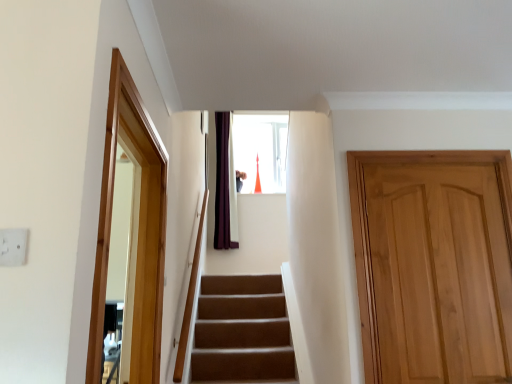
Question: Is wooden frame at left positioned with its back to light brown wood door at right?

Choices:
 (A) no
 (B) yes

Answer: (A)

Question: Does wooden frame at left contain light brown wood door at right?

Choices:
 (A) yes
 (B) no

Answer: (B)

Question: From a real-world perspective, is wooden frame at left located beneath light brown wood door at right?

Choices:
 (A) no
 (B) yes

Answer: (A)

Question: Does wooden frame at left have a smaller size compared to light brown wood door at right?

Choices:
 (A) no
 (B) yes

Answer: (A)

Question: Does wooden frame at left have a larger size compared to light brown wood door at right?

Choices:
 (A) no
 (B) yes

Answer: (B)

Question: Is wooden frame at left oriented towards light brown wood door at right?

Choices:
 (A) no
 (B) yes

Answer: (B)

Question: Does light brown wood door at right lie in front of wooden frame at left?

Choices:
 (A) no
 (B) yes

Answer: (A)

Question: Is light brown wood door at right far from wooden frame at left?

Choices:
 (A) yes
 (B) no

Answer: (A)

Question: From a real-world perspective, is light brown wood door at right positioned over wooden frame at left based on gravity?

Choices:
 (A) no
 (B) yes

Answer: (A)

Question: Does light brown wood door at right appear on the left side of wooden frame at left?

Choices:
 (A) no
 (B) yes

Answer: (A)

Question: Can you confirm if light brown wood door at right is positioned to the right of wooden frame at left?

Choices:
 (A) yes
 (B) no

Answer: (A)

Question: Can you confirm if light brown wood door at right is bigger than wooden frame at left?

Choices:
 (A) yes
 (B) no

Answer: (B)

Question: Does point (109, 144) appear closer or farther from the camera than point (446, 251)?

Choices:
 (A) farther
 (B) closer

Answer: (B)